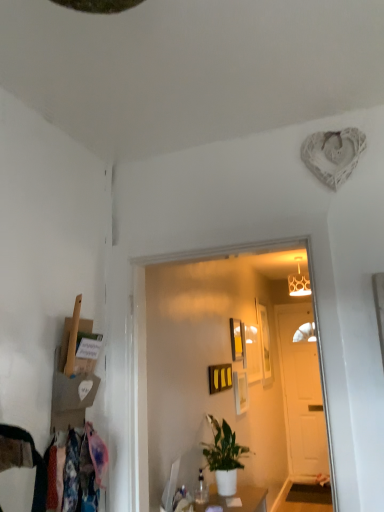
Question: Choose the correct answer: Is white wooden door at center inside matte black picture frame at center, the 3th picture frame when ordered from front to back, or outside it?

Choices:
 (A) inside
 (B) outside

Answer: (B)

Question: From a real-world perspective, is white wooden door at center physically located above or below matte black picture frame at center, the 3th picture frame when ordered from front to back?

Choices:
 (A) below
 (B) above

Answer: (A)

Question: Estimate the real-world distances between objects in this image. Which object is farther from the yellow matte picture frame at center, the first picture frame from the front?

Choices:
 (A) wooden picture frame at center, arranged as the 1th picture frame when viewed from the back
 (B) matte black picture frame at center, the 3th picture frame when ordered from front to back
 (C) matte gold lampshade at upper center
 (D) floral fabric laundry at lower left
 (E) matte white picture frame at upper center, which appears as the 2th picture frame when viewed from the back

Answer: (D)

Question: Considering the real-world distances, which object is closest to the matte black picture frame at center, the 3th picture frame when ordered from front to back?

Choices:
 (A) matte black picture frame at center, marked as the fourth picture frame in a back-to-front arrangement
 (B) floral fabric laundry at lower left
 (C) matte gold lampshade at upper center
 (D) wooden picture frame at center, arranged as the 1th picture frame when viewed from the back
 (E) yellow matte picture frame at center, the first picture frame from the front

Answer: (A)